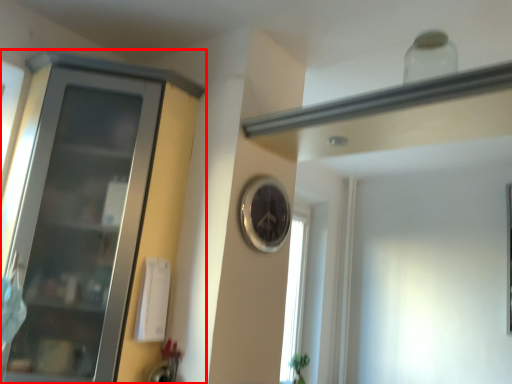
Question: Observing the image, what is the correct spatial positioning of cupboard (annotated by the red box) in reference to clock?

Choices:
 (A) left
 (B) right

Answer: (A)